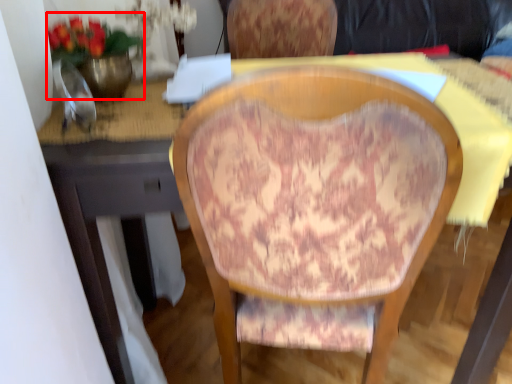
Question: From the image's perspective, where is floral arrangement (annotated by the red box) located in relation to chair in the image?

Choices:
 (A) above
 (B) below

Answer: (A)